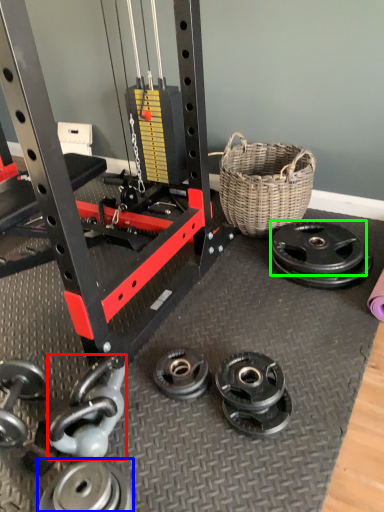
Question: Considering the real-world distances, which object is closest to dumbbell (highlighted by a red box)? wheel (highlighted by a blue box) or wheel (highlighted by a green box).

Choices:
 (A) wheel
 (B) wheel

Answer: (A)